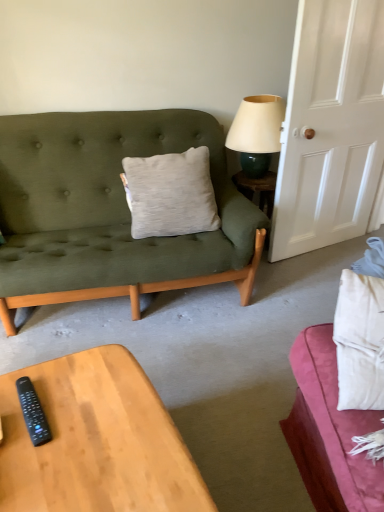
Identify the location of vacant region in front of black plastic remote at lower left. (34, 462).